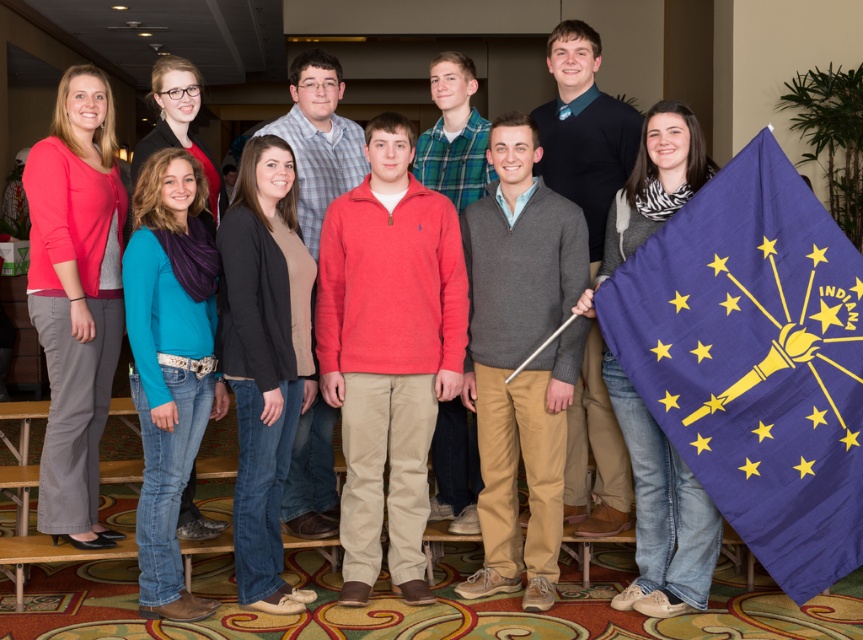
You are standing at the base of the staircase where the group is posing. You want to pick up the blue fabric flag at lower right without moving your feet. Can you reach it?

The blue fabric flag at lower right is 3.65 meters away from you, which is too far to reach without moving your feet.

You are organizing a photo shoot and need to ensure that the two central outfits, the matte pink sweater at center and the black cardigan at center, can fit side by side on a mannequin stand that is 1.2 meters wide. Based on their sizes, will they fit comfortably?

The matte pink sweater at center has a larger width than the black cardgan at center. However, since the total width of both items combined is not provided, it is impossible to determine if they will fit on the 1.2 meter wide mannequin stand.